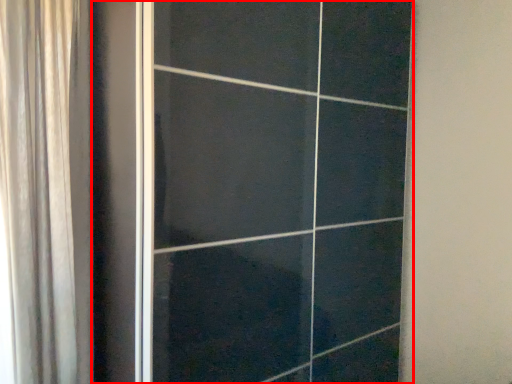
Question: From the image's perspective, where is door (annotated by the red box) located in relation to curtain in the image?

Choices:
 (A) above
 (B) below

Answer: (B)